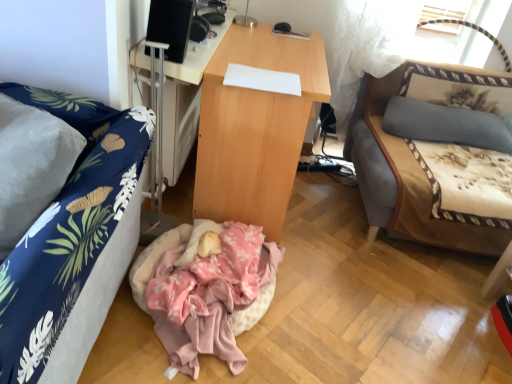
Image resolution: width=512 pixels, height=384 pixels. In order to click on blue fabric couch at left, which is counted as the first studio couch, starting from the left in this screenshot , I will do `click(67, 227)`.

The image size is (512, 384). Describe the element at coordinates (445, 124) in the screenshot. I see `gray fabric pillow at right` at that location.

The image size is (512, 384). Describe the element at coordinates (170, 26) in the screenshot. I see `black matte speaker at upper center` at that location.

The height and width of the screenshot is (384, 512). What do you see at coordinates (436, 155) in the screenshot?
I see `beige fabric studio couch at right, the first studio couch from the right` at bounding box center [436, 155].

Image resolution: width=512 pixels, height=384 pixels. What do you see at coordinates (365, 47) in the screenshot?
I see `white sheer curtain at upper right` at bounding box center [365, 47].

What are the coordinates of `light brown wood desk at center, which is the 1th desk from right to left` in the screenshot? It's located at (255, 128).

Can you confirm if gray fabric pillow at right is taller than white sheer curtain at upper right?

No, gray fabric pillow at right is not taller than white sheer curtain at upper right.

From a real-world perspective, is gray fabric pillow at right below white sheer curtain at upper right?

Yes, from a real-world perspective, gray fabric pillow at right is below white sheer curtain at upper right.

Is gray fabric pillow at right at the right side of white sheer curtain at upper right?

Yes, gray fabric pillow at right is to the right of white sheer curtain at upper right.

Does gray fabric pillow at right touch white sheer curtain at upper right?

No.

Looking at the image, does blue fabric couch at left, the 2th studio couch positioned from the right, seem bigger or smaller compared to white sheer curtain at upper right?

In the image, blue fabric couch at left, the 2th studio couch positioned from the right, appears to be larger than white sheer curtain at upper right.

Considering the positions of objects blue fabric couch at left, acting as the 1th studio couch starting from the front, and white sheer curtain at upper right in the image provided, who is in front, blue fabric couch at left, acting as the 1th studio couch starting from the front, or white sheer curtain at upper right?

blue fabric couch at left, acting as the 1th studio couch starting from the front, is more forward.

Is blue fabric couch at left, which is the 2th studio couch from back to front, looking in the opposite direction of white sheer curtain at upper right?

No, blue fabric couch at left, which is the 2th studio couch from back to front, is not facing the opposite direction of white sheer curtain at upper right.

How far apart are blue fabric couch at left, which is the 2th studio couch from back to front, and white sheer curtain at upper right?

They are 5.10 feet apart.

Is white sheer curtain at upper right bigger or smaller than blue fabric couch at left, which is the 2th studio couch from back to front?

white sheer curtain at upper right is smaller than blue fabric couch at left, which is the 2th studio couch from back to front.

Is white sheer curtain at upper right turned away from blue fabric couch at left, which is counted as the first studio couch, starting from the left?

That's not correct — white sheer curtain at upper right is not looking away from blue fabric couch at left, which is counted as the first studio couch, starting from the left.

Is white sheer curtain at upper right at the right side of blue fabric couch at left, which is counted as the first studio couch, starting from the left?

Indeed, white sheer curtain at upper right is positioned on the right side of blue fabric couch at left, which is counted as the first studio couch, starting from the left.

Which of these two, gray fabric pillow at right or beige fabric studio couch at right, which is counted as the 2th studio couch, starting from the front, is bigger?

beige fabric studio couch at right, which is counted as the 2th studio couch, starting from the front.

Between gray fabric pillow at right and beige fabric studio couch at right, which is counted as the 2th studio couch, starting from the front, which one has more height?

beige fabric studio couch at right, which is counted as the 2th studio couch, starting from the front.

Looking at this image, considering the positions of objects gray fabric pillow at right and beige fabric studio couch at right, which is counted as the 2th studio couch, starting from the front, in the image provided, who is behind, gray fabric pillow at right or beige fabric studio couch at right, which is counted as the 2th studio couch, starting from the front,?

gray fabric pillow at right is further away from the camera.

Between white sheer curtain at upper right and wooden desk at center, the 2th desk in the right-to-left sequence, which one has smaller size?

wooden desk at center, the 2th desk in the right-to-left sequence, is smaller.

Does white sheer curtain at upper right appear on the right side of wooden desk at center, the 2th desk in the right-to-left sequence?

Correct, you'll find white sheer curtain at upper right to the right of wooden desk at center, the 2th desk in the right-to-left sequence.

From a real-world perspective, is white sheer curtain at upper right over wooden desk at center, the 2th desk in the right-to-left sequence?

Correct, in the physical world, white sheer curtain at upper right is higher than wooden desk at center, the 2th desk in the right-to-left sequence.

Is white sheer curtain at upper right oriented towards wooden desk at center, arranged as the 1th desk when viewed from the left?

No, white sheer curtain at upper right is not facing towards wooden desk at center, arranged as the 1th desk when viewed from the left.

From a real-world perspective, who is located higher, black matte speaker at upper center or white sheer curtain at upper right?

black matte speaker at upper center, from a real-world perspective.

Does black matte speaker at upper center have a lesser width compared to white sheer curtain at upper right?

Indeed, black matte speaker at upper center has a lesser width compared to white sheer curtain at upper right.

Looking at this image, is black matte speaker at upper center positioned far away from white sheer curtain at upper right?

Yes, black matte speaker at upper center and white sheer curtain at upper right are quite far apart.

The width and height of the screenshot is (512, 384). I want to click on speaker lying in front of the white sheer curtain at upper right, so click(170, 26).

Is white sheer curtain at upper right to the right of black matte speaker at upper center from the viewer's perspective?

Correct, you'll find white sheer curtain at upper right to the right of black matte speaker at upper center.

Is white sheer curtain at upper right with black matte speaker at upper center?

There is a gap between white sheer curtain at upper right and black matte speaker at upper center.

The width and height of the screenshot is (512, 384). I want to click on pillow behind the white sheer curtain at upper right, so click(x=445, y=124).

This screenshot has height=384, width=512. There is a blue fabric couch at left, the 2th studio couch positioned from the right. Identify the location of curtain above it (from a real-world perspective). (365, 47).

Looking at the image, which one is located closer to white sheer curtain at upper right, gray fabric pillow at right or pink fabric infant bed at center?

gray fabric pillow at right.

From the picture: Estimate the real-world distances between objects in this image. Which object is further from beige fabric studio couch at right, the first studio couch viewed from the back, light brown wood desk at center, which is the 1th desk from right to left, or wooden desk at center, arranged as the 1th desk when viewed from the left?

wooden desk at center, arranged as the 1th desk when viewed from the left.

From the image, which object appears to be nearer to white sheer curtain at upper right, light brown wood desk at center, the second desk positioned from the left, or beige fabric studio couch at right, the first studio couch viewed from the back?

A: beige fabric studio couch at right, the first studio couch viewed from the back, lies closer to white sheer curtain at upper right than the other object.

Considering their positions, is black matte speaker at upper center positioned further to gray fabric pillow at right than pink fabric infant bed at center?

black matte speaker at upper center is further to gray fabric pillow at right.

Consider the image. Based on their spatial positions, is light brown wood desk at center, the second desk positioned from the left, or beige fabric studio couch at right, the first studio couch from the right, closer to pink fabric infant bed at center?

Based on the image, light brown wood desk at center, the second desk positioned from the left, appears to be nearer to pink fabric infant bed at center.

Looking at the image, which one is located further to black matte speaker at upper center, wooden desk at center, arranged as the 1th desk when viewed from the left, or light brown wood desk at center, the second desk positioned from the left?

Among the two, light brown wood desk at center, the second desk positioned from the left, is located further to black matte speaker at upper center.

Which object lies further to the anchor point light brown wood desk at center, the second desk positioned from the left, white sheer curtain at upper right or gray fabric pillow at right?

gray fabric pillow at right is further to light brown wood desk at center, the second desk positioned from the left.

Considering their positions, is gray fabric pillow at right positioned closer to wooden desk at center, arranged as the 1th desk when viewed from the left, than black matte speaker at upper center?

black matte speaker at upper center is closer to wooden desk at center, arranged as the 1th desk when viewed from the left.

Identify the location of curtain between pink fabric infant bed at center and beige fabric studio couch at right, the 2th studio couch viewed from the left. The width and height of the screenshot is (512, 384). 365,47.

At what (x,y) coordinates should I click in order to perform the action: click on desk between wooden desk at center, the 2th desk in the right-to-left sequence, and gray fabric pillow at right. Please return your answer as a coordinate pair (x, y). The height and width of the screenshot is (384, 512). Looking at the image, I should click on pyautogui.click(x=255, y=128).

Where is `desk between wooden desk at center, arranged as the 1th desk when viewed from the left, and beige fabric studio couch at right, the 2th studio couch viewed from the left`? This screenshot has width=512, height=384. desk between wooden desk at center, arranged as the 1th desk when viewed from the left, and beige fabric studio couch at right, the 2th studio couch viewed from the left is located at coordinates (255, 128).

This screenshot has width=512, height=384. I want to click on speaker located between wooden desk at center, arranged as the 1th desk when viewed from the left, and gray fabric pillow at right in the left-right direction, so click(x=170, y=26).